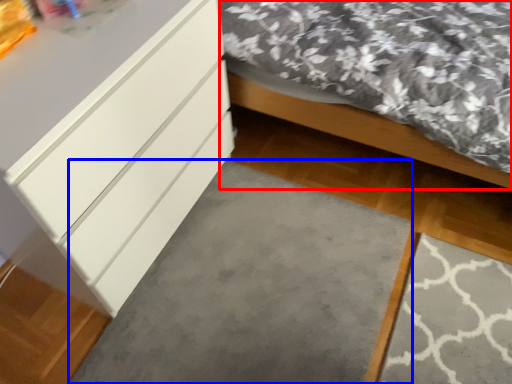
Question: Which object is closer to the camera taking this photo, bed (highlighted by a red box) or concrete (highlighted by a blue box)?

Choices:
 (A) bed
 (B) concrete

Answer: (A)